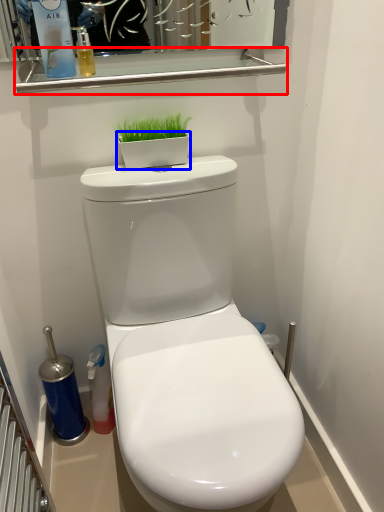
Question: Which of the following is the farthest to the observer, balustrade (highlighted by a red box) or flowerpot (highlighted by a blue box)?

Choices:
 (A) balustrade
 (B) flowerpot

Answer: (B)